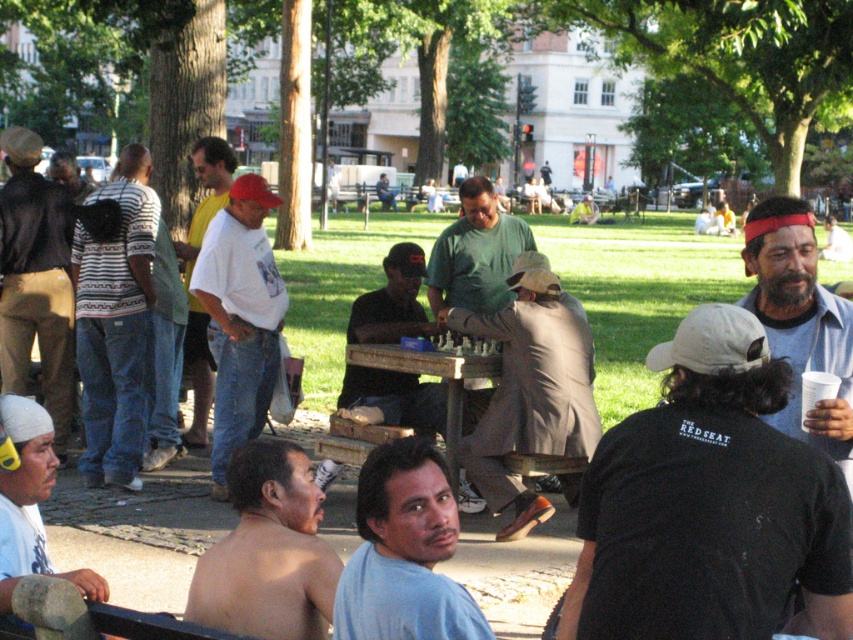
Question: Is shiny skin at center below white t-shirt at center?

Choices:
 (A) yes
 (B) no

Answer: (A)

Question: Does matte blue shirt at right have a larger size compared to matte brown cap at center?

Choices:
 (A) yes
 (B) no

Answer: (A)

Question: Which of these objects is positioned farthest from the striped shirt at left?

Choices:
 (A) wooden picnic table at center
 (B) light blue shirt at lower left
 (C) brown leather jacket at center
 (D) shiny skin at center

Answer: (D)

Question: Which of the following is the closest to the observer?

Choices:
 (A) striped shirt at left
 (B) white cotton shirt at center

Answer: (B)

Question: Does shiny skin at center have a larger size compared to blue t-shirt at lower center?

Choices:
 (A) no
 (B) yes

Answer: (A)

Question: Which point appears closest to the camera in this image?

Choices:
 (A) (761, 417)
 (B) (352, 557)

Answer: (A)